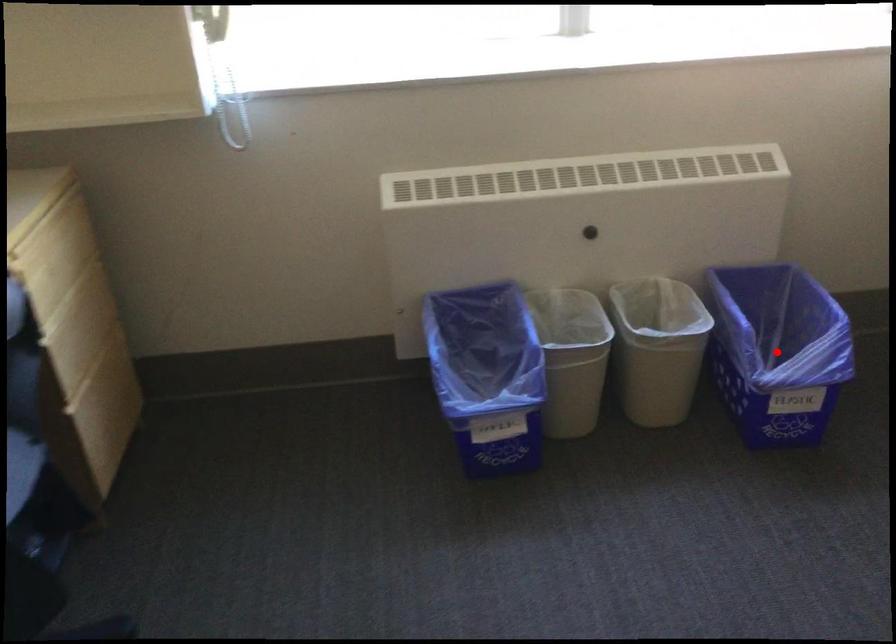
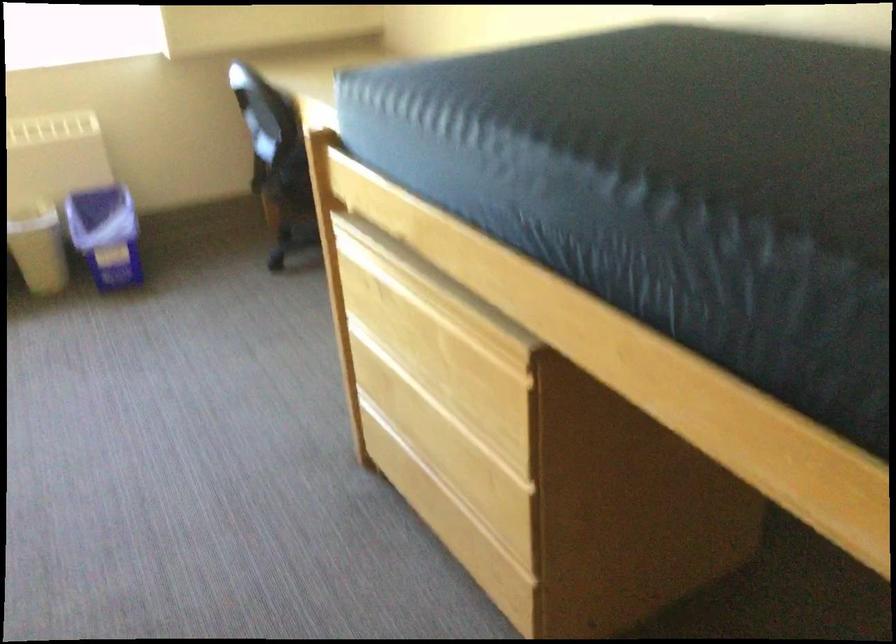
Question: I am providing you with two images of the same scene from different viewpoints. A red point is marked on the first image. At the location where the point appears in image 1, is it still visible in image 2?

Choices:
 (A) Yes
 (B) No

Answer: (B)